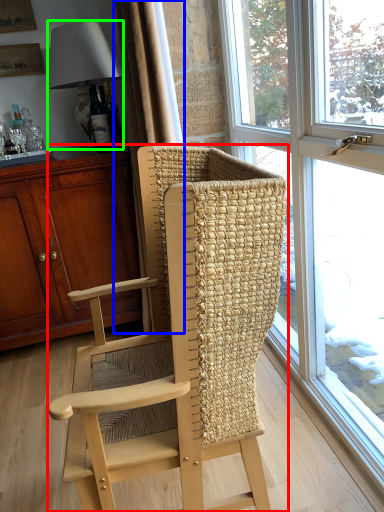
Question: Based on their relative distances, which object is farther from chair (highlighted by a red box)? Choose from curtain (highlighted by a blue box) and lamp (highlighted by a green box).

Choices:
 (A) curtain
 (B) lamp

Answer: (B)